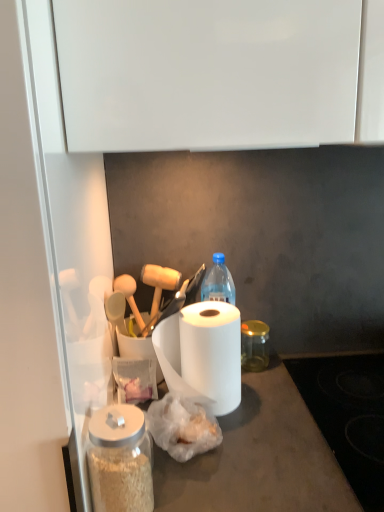
Question: Is white matte paper towel at center positioned behind transparent glass jar at lower left, which ranks as the 2th glass jar in back-to-front order?

Choices:
 (A) no
 (B) yes

Answer: (B)

Question: Is white matte paper towel at center far from transparent glass jar at lower left, which ranks as the 2th glass jar in back-to-front order?

Choices:
 (A) no
 (B) yes

Answer: (A)

Question: Considering the relative sizes of white matte paper towel at center and transparent glass jar at lower left, the second glass jar in the right-to-left sequence, in the image provided, is white matte paper towel at center bigger than transparent glass jar at lower left, the second glass jar in the right-to-left sequence,?

Choices:
 (A) no
 (B) yes

Answer: (B)

Question: From a real-world perspective, does white matte paper towel at center stand above transparent glass jar at lower left, the second glass jar in the right-to-left sequence?

Choices:
 (A) no
 (B) yes

Answer: (B)

Question: Does white matte paper towel at center have a smaller size compared to transparent glass jar at lower left, arranged as the 1th glass jar when viewed from the front?

Choices:
 (A) yes
 (B) no

Answer: (B)

Question: Based on their sizes in the image, would you say transparent glass jar at lower left, arranged as the 1th glass jar when viewed from the front, is bigger or smaller than translucent plastic bag at center?

Choices:
 (A) big
 (B) small

Answer: (B)

Question: Is transparent glass jar at lower left, which ranks as the 2th glass jar in back-to-front order, situated inside translucent plastic bag at center or outside?

Choices:
 (A) outside
 (B) inside

Answer: (A)

Question: Is point (107, 466) closer or farther from the camera than point (157, 433)?

Choices:
 (A) farther
 (B) closer

Answer: (B)

Question: Visually, is transparent glass jar at lower left, arranged as the 1th glass jar when viewed from the front, positioned to the left or to the right of translucent plastic bag at center?

Choices:
 (A) right
 (B) left

Answer: (B)

Question: Looking at the image, does translucent plastic bag at center seem bigger or smaller compared to transparent glass jar at center, the 1th glass jar from the back?

Choices:
 (A) big
 (B) small

Answer: (A)

Question: Is translucent plastic bag at center in front of or behind transparent glass jar at center, the 1th glass jar from the back, in the image?

Choices:
 (A) front
 (B) behind

Answer: (A)

Question: Is translucent plastic bag at center wider or thinner than transparent glass jar at center, the 1th glass jar from the back?

Choices:
 (A) wide
 (B) thin

Answer: (A)

Question: Is translucent plastic bag at center inside or outside of transparent glass jar at center, which is the second glass jar from left to right?

Choices:
 (A) inside
 (B) outside

Answer: (B)

Question: From the image's perspective, is translucent plastic bag at center located above or below white matte paper towel at center?

Choices:
 (A) below
 (B) above

Answer: (A)

Question: Looking at their shapes, would you say translucent plastic bag at center is wider or thinner than white matte paper towel at center?

Choices:
 (A) thin
 (B) wide

Answer: (A)